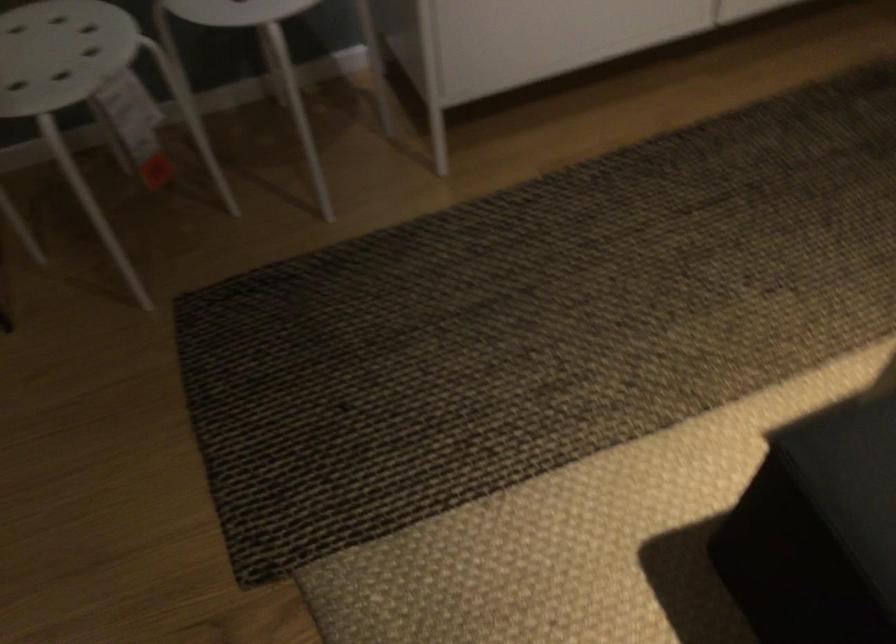
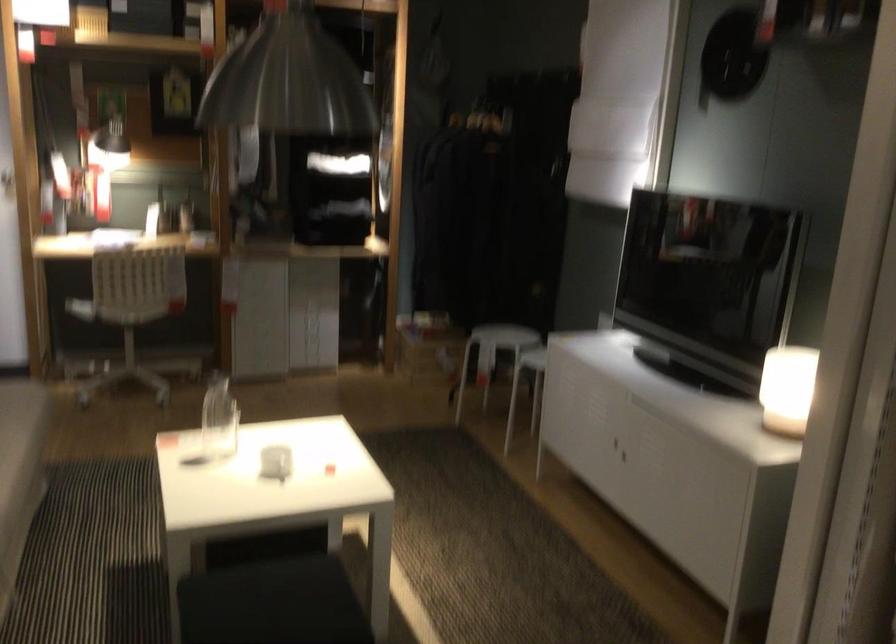
Find the pixel in the second image that matches point (141, 116) in the first image.

(492, 355)